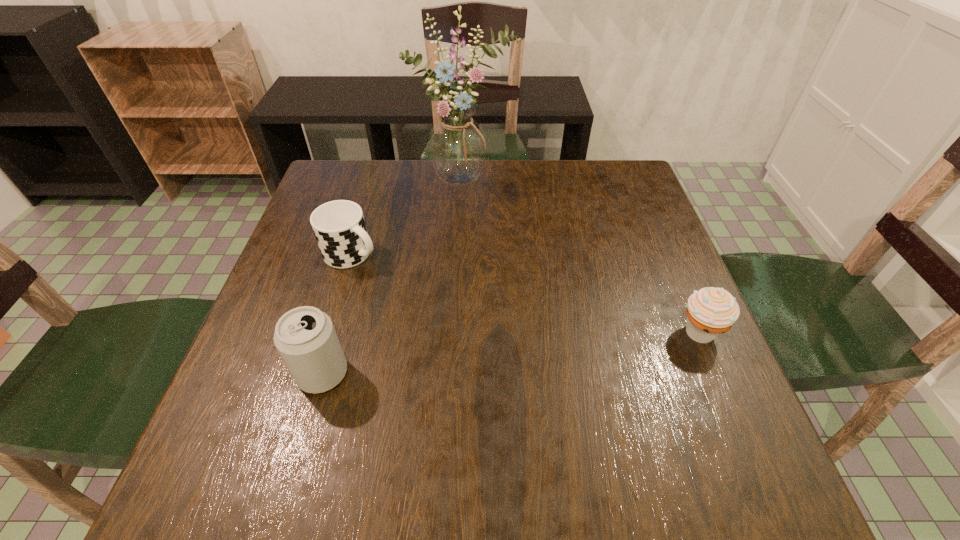
Image resolution: width=960 pixels, height=540 pixels. I want to click on object located in the near left corner section of the desktop, so click(305, 337).

The width and height of the screenshot is (960, 540). Find the location of `vacant space at the far edge of the desktop`. vacant space at the far edge of the desktop is located at coordinates (388, 168).

This screenshot has width=960, height=540. What are the coordinates of `blank space at the near edge` in the screenshot? It's located at (357, 420).

In the image, there is a desktop. Identify the location of vacant space at the right edge. (677, 301).

Find the location of `free space at the far left corner of the desktop`. free space at the far left corner of the desktop is located at coordinates (340, 186).

Locate an element on the screen. Image resolution: width=960 pixels, height=540 pixels. vacant region at the near left corner of the desktop is located at coordinates (260, 417).

You are a GUI agent. You are given a task and a screenshot of the screen. Output one action in this format:
    pyautogui.click(x=<x>, y=<y>)
    Task: Click on the vacant region at the far right corner of the desktop
    This screenshot has width=960, height=540.
    Given the screenshot: What is the action you would take?
    pyautogui.click(x=636, y=173)

The height and width of the screenshot is (540, 960). Find the location of `vacant area that lies between the rightmost object and the nearest object`. vacant area that lies between the rightmost object and the nearest object is located at coordinates (511, 353).

Where is `vacant area that lies between the third farthest object and the third object from left to right`? vacant area that lies between the third farthest object and the third object from left to right is located at coordinates (581, 256).

Locate an element on the screen. This screenshot has height=540, width=960. vacant space in between the second farthest object and the farthest object is located at coordinates (408, 217).